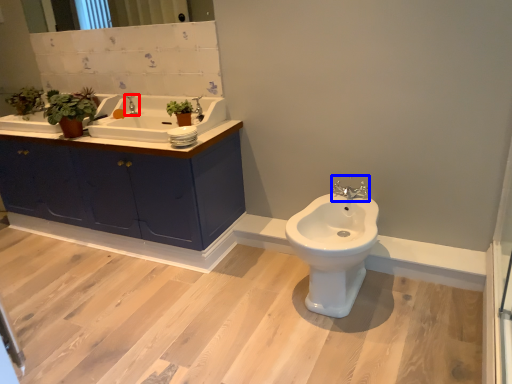
Question: Which of the following is the closest to the observer, tap (highlighted by a red box) or tap (highlighted by a blue box)?

Choices:
 (A) tap
 (B) tap

Answer: (B)